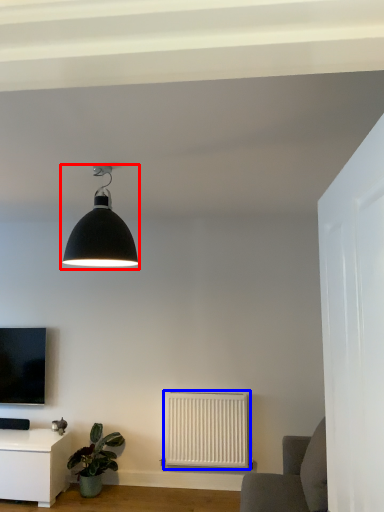
Question: Which point is closer to the camera, lamp (highlighted by a red box) or radiator (highlighted by a blue box)?

Choices:
 (A) lamp
 (B) radiator

Answer: (A)